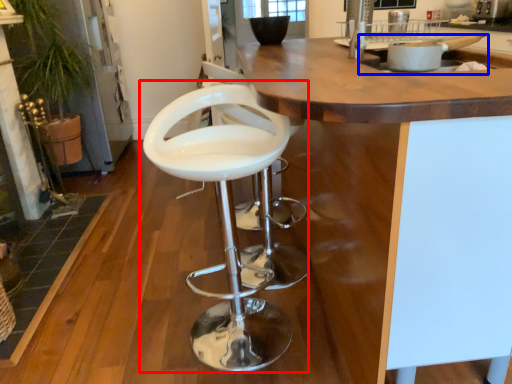
Question: Among these objects, which one is farthest to the camera, chair (highlighted by a red box) or sink (highlighted by a blue box)?

Choices:
 (A) chair
 (B) sink

Answer: (B)